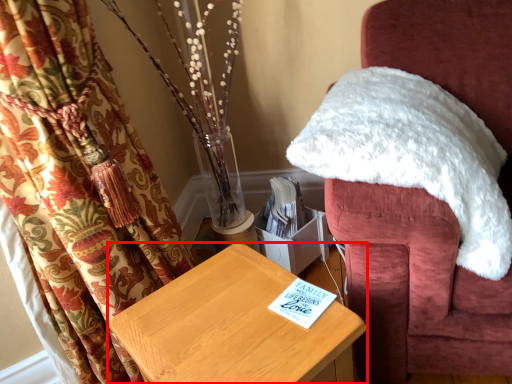
Question: From the image's perspective, where is furniture (annotated by the red box) located in relation to chair in the image?

Choices:
 (A) below
 (B) above

Answer: (A)